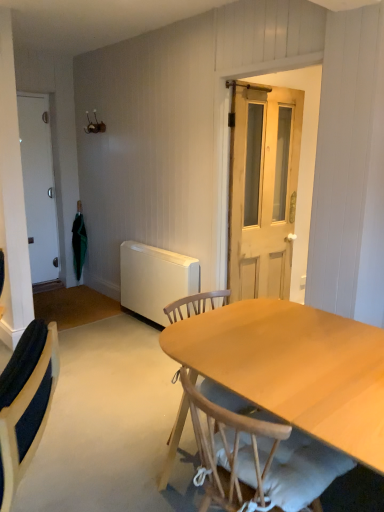
Where is `free space to the left of white fabric tablecloth at center`? free space to the left of white fabric tablecloth at center is located at coordinates (126, 450).